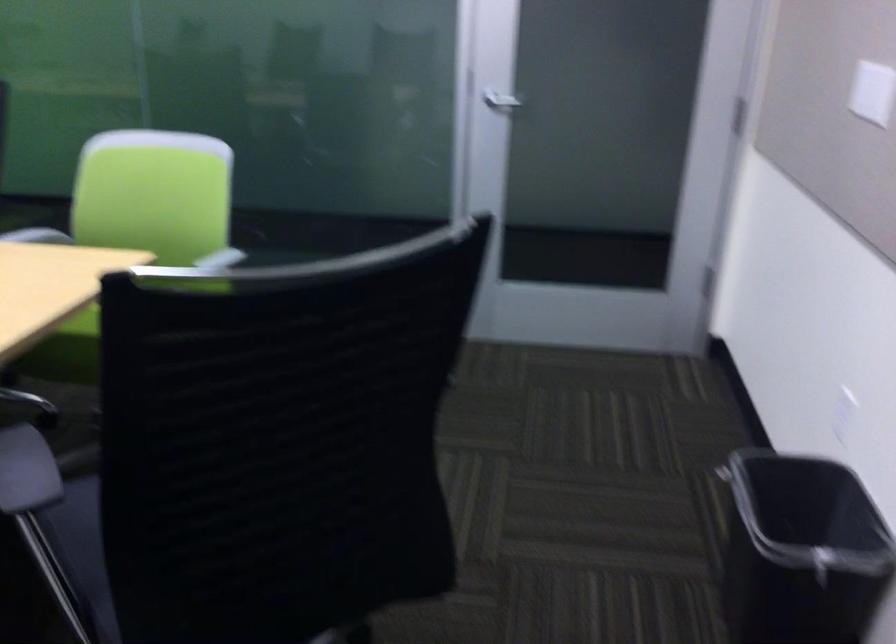
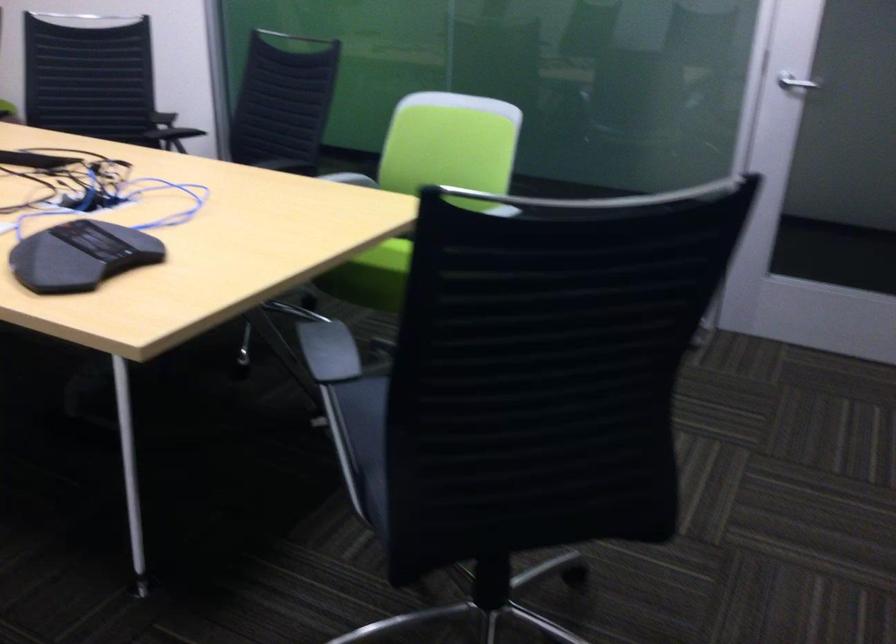
Question: The camera is either moving clockwise (left) or counter-clockwise (right) around the object. The first image is from the beginning of the video and the second image is from the end. Is the camera moving left or right when shooting the video?

Choices:
 (A) Left
 (B) Right

Answer: (B)